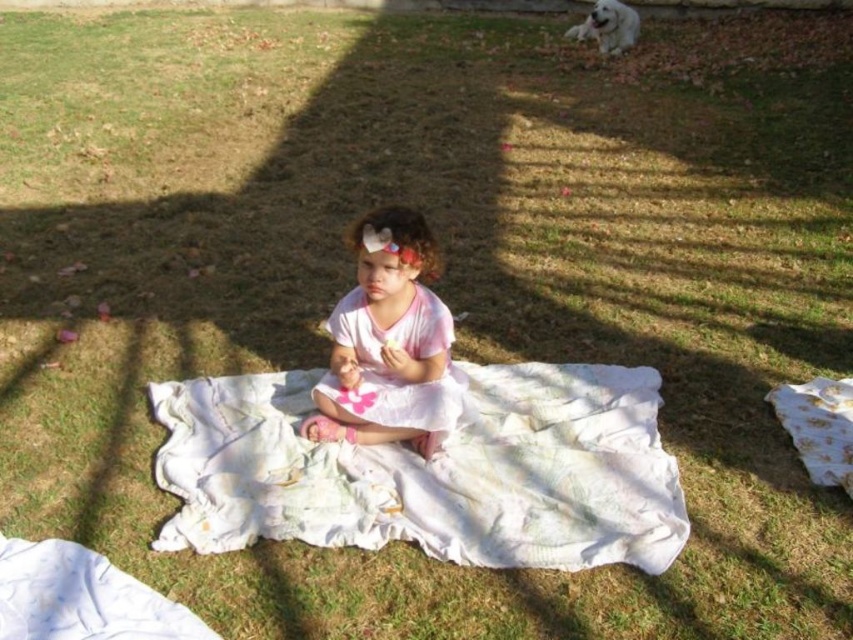
Question: Is white textured blanket at center below pink satin dress at center?

Choices:
 (A) no
 (B) yes

Answer: (B)

Question: Is white textured blanket at center thinner than pink satin dress at center?

Choices:
 (A) no
 (B) yes

Answer: (A)

Question: Does white textured blanket at center appear over pink satin dress at center?

Choices:
 (A) no
 (B) yes

Answer: (A)